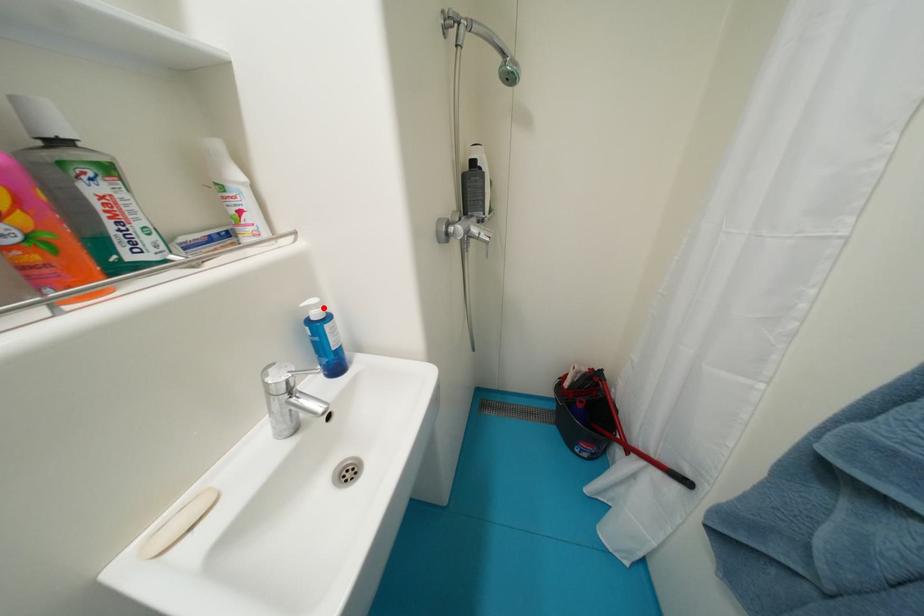
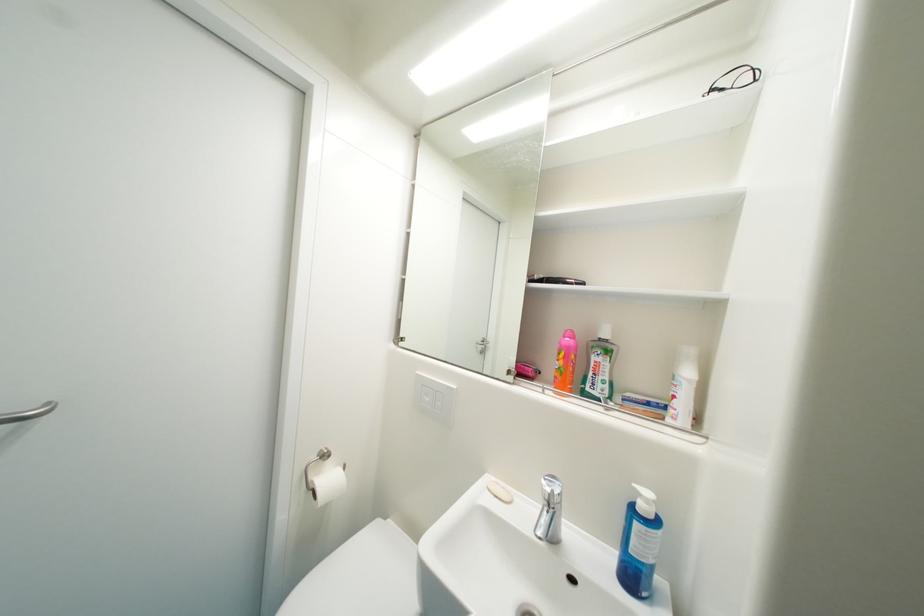
The point at the highlighted location is marked in the first image. Where is the corresponding point in the second image?

(653, 503)